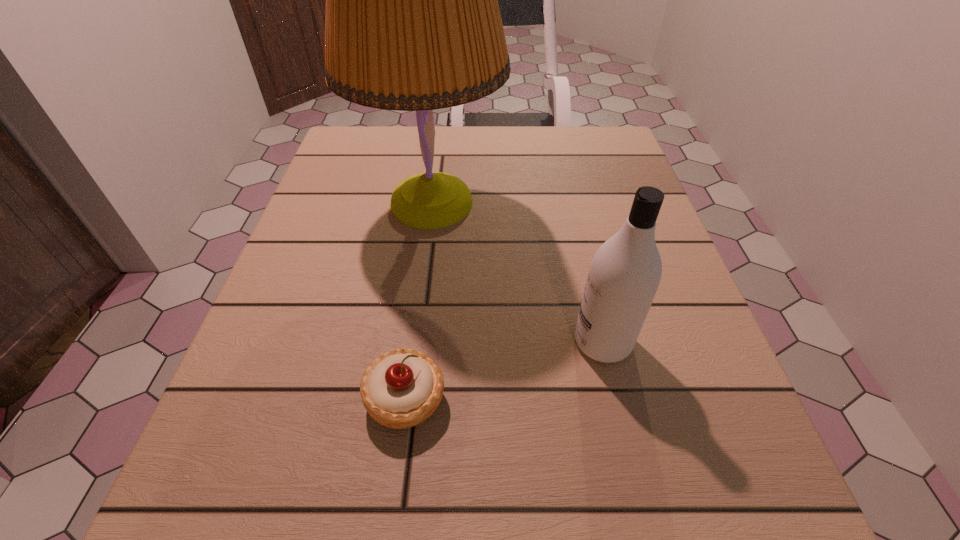
Where is `unoccupied area between the shortest object and the farthest object`? unoccupied area between the shortest object and the farthest object is located at coordinates (419, 301).

Choose which object is the nearest neighbor to the pastry. Please provide its 2D coordinates. Your answer should be formatted as a tuple, i.e. [(x, y)], where the tuple contains the x and y coordinates of a point satisfying the conditions above.

[(625, 272)]

Locate which object is the closest to the shampoo. Please provide its 2D coordinates. Your answer should be formatted as a tuple, i.e. [(x, y)], where the tuple contains the x and y coordinates of a point satisfying the conditions above.

[(412, 23)]

Find the location of a particular element. Image resolution: width=960 pixels, height=540 pixels. vacant point that satisfies the following two spatial constraints: 1. on the front-facing side of the shampoo; 2. on the front side of the pastry is located at coordinates (615, 398).

Find the location of a particular element. This screenshot has height=540, width=960. vacant space that satisfies the following two spatial constraints: 1. on the front-facing side of the second shortest object; 2. on the front side of the pastry is located at coordinates tap(615, 398).